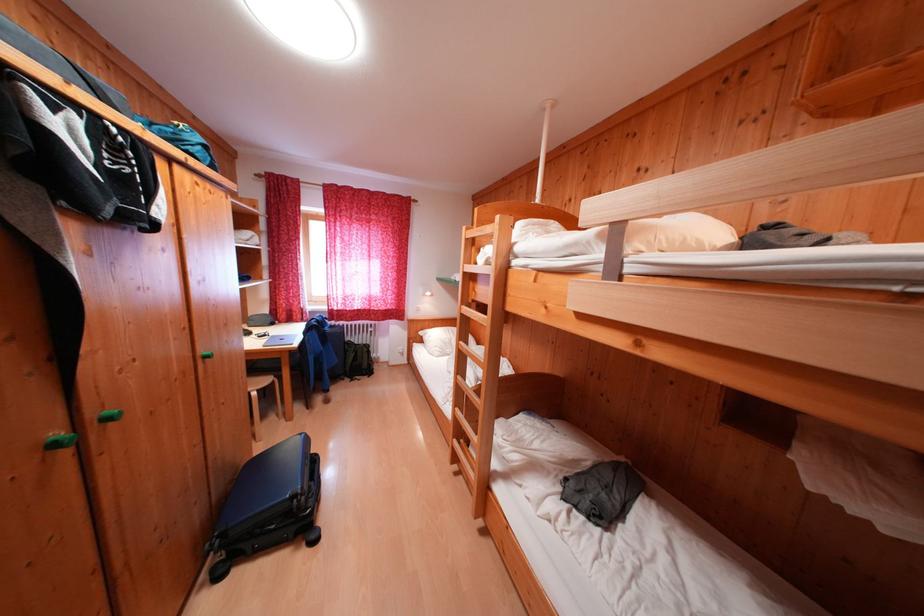
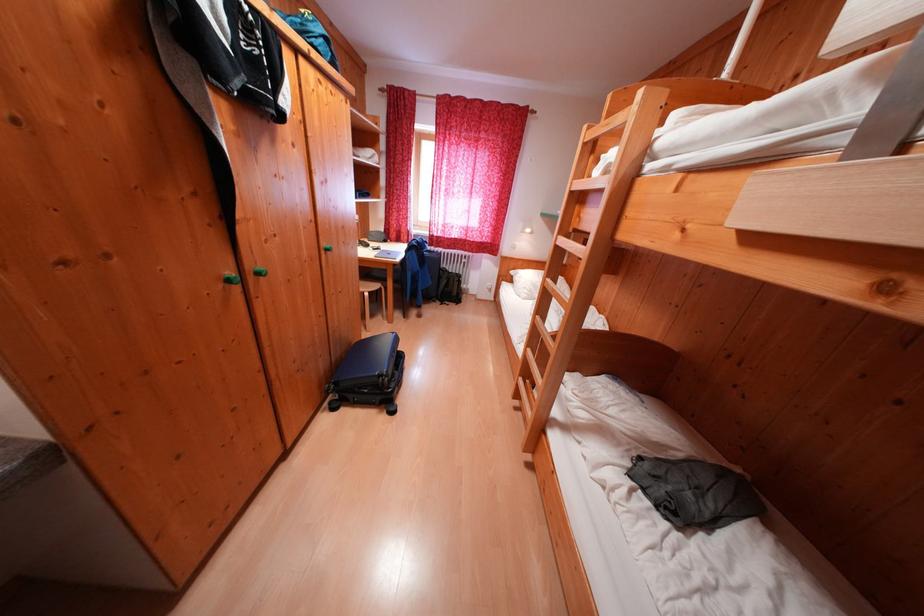
The images are taken continuously from a first-person perspective. In which direction are you moving?

The cameraman moved toward right, forward.